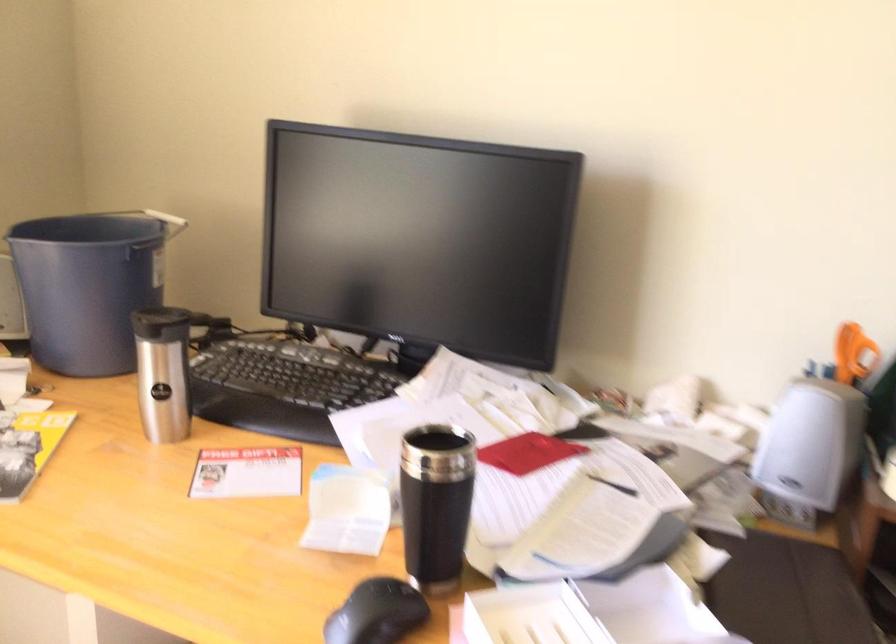
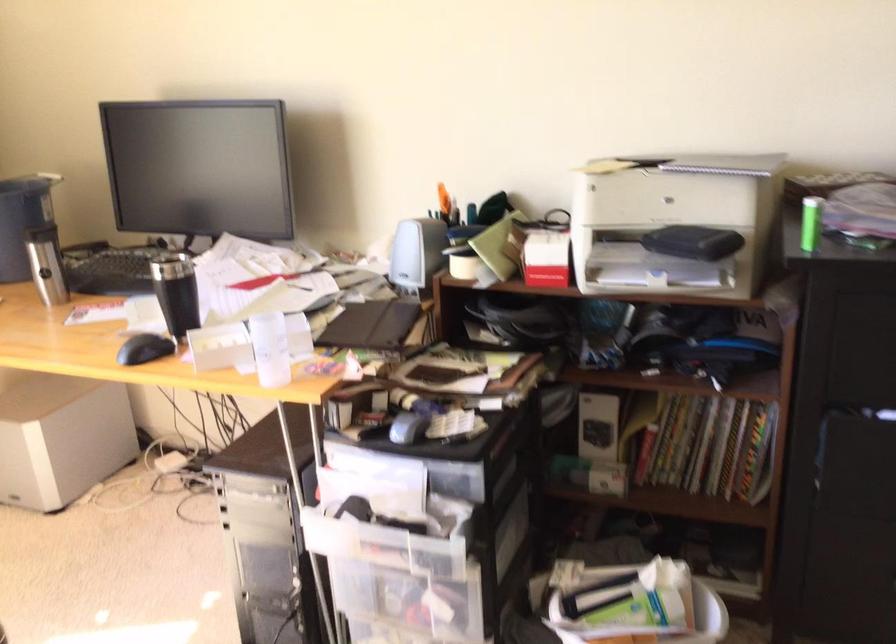
Find the pixel in the second image that matches point 434,504 in the first image.

(176, 292)